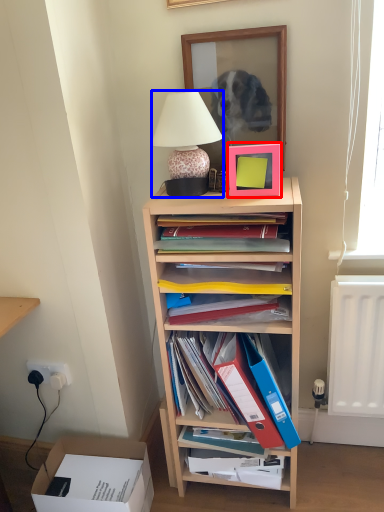
Question: Which object appears farthest to the camera in this image, picture frame (highlighted by a red box) or lamp (highlighted by a blue box)?

Choices:
 (A) picture frame
 (B) lamp

Answer: (A)